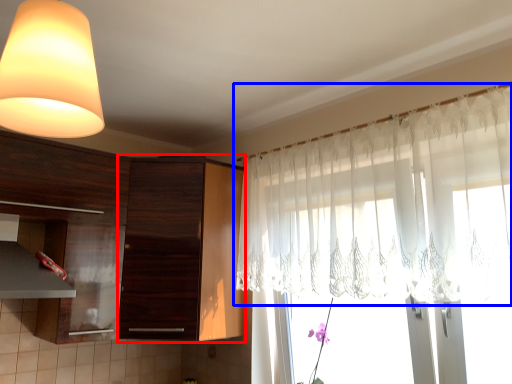
Question: Which point is further to the camera, cabinetry (highlighted by a red box) or curtain (highlighted by a blue box)?

Choices:
 (A) cabinetry
 (B) curtain

Answer: (A)